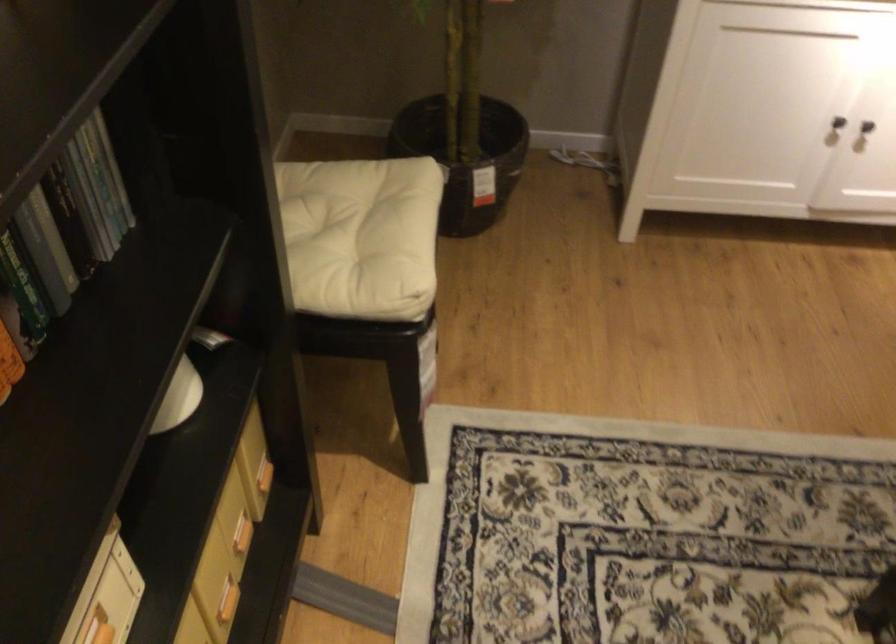
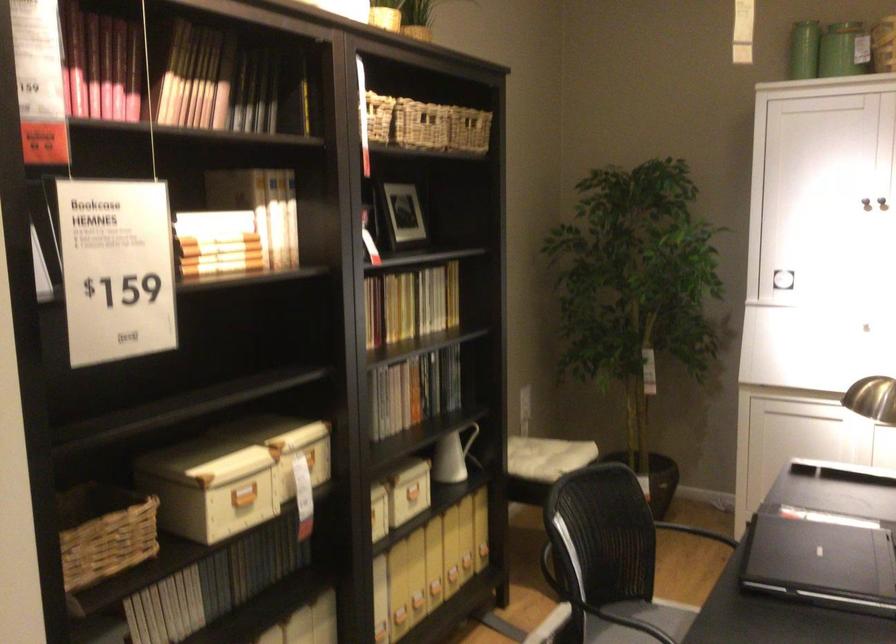
Find the pixel in the second image that matches point 546,230 in the first image.

(695, 532)